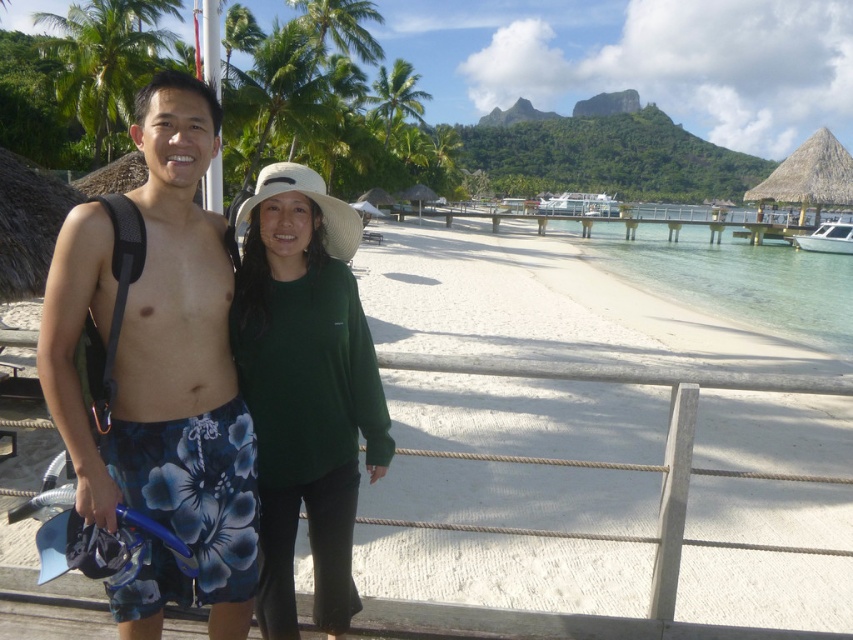
Question: Estimate the real-world distances between objects in this image. Which object is closer to the white sand beach at center?

Choices:
 (A) blue floral swim trunks at center
 (B) white glossy boat at right

Answer: (A)

Question: Considering the real-world distances, which object is closest to the blue floral swim trunks at center?

Choices:
 (A) white sand beach at center
 (B) white glossy boat at right
 (C) clear water at beach right

Answer: (A)

Question: In this image, where is green matte hat at center located relative to white glossy boat at right?

Choices:
 (A) left
 (B) right

Answer: (A)

Question: Which is farther from the white sand beach at center?

Choices:
 (A) green matte hat at center
 (B) white glossy boat at right
 (C) clear water at beach right
 (D) blue floral swim trunks at center

Answer: (B)

Question: Is blue floral swim trunks at center positioned behind clear water at beach right?

Choices:
 (A) yes
 (B) no

Answer: (B)

Question: Can you confirm if blue floral swim trunks at center is positioned below green matte hat at center?

Choices:
 (A) no
 (B) yes

Answer: (A)